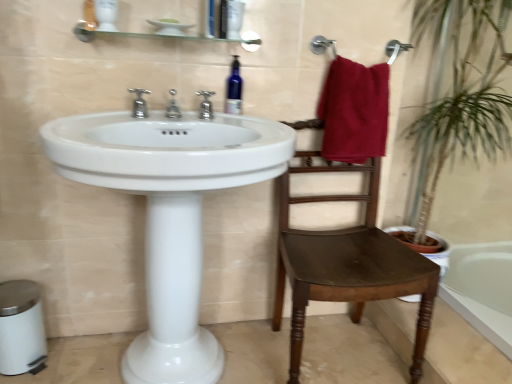
Where is `polished chrome faucet at center, the 1th tap in the right-to-left sequence`? Image resolution: width=512 pixels, height=384 pixels. polished chrome faucet at center, the 1th tap in the right-to-left sequence is located at coordinates (206, 105).

What is the approximate width of silver metallic faucet at upper center, the 2th tap when ordered from left to right?

silver metallic faucet at upper center, the 2th tap when ordered from left to right, is 5.77 inches wide.

Image resolution: width=512 pixels, height=384 pixels. What do you see at coordinates (170, 213) in the screenshot?
I see `white glossy sink at center` at bounding box center [170, 213].

I want to click on polished chrome faucet at center, the third tap from the right, so click(x=139, y=103).

This screenshot has width=512, height=384. What are the coordinates of `dark wood chair at right` in the screenshot? It's located at (347, 263).

The height and width of the screenshot is (384, 512). In order to click on maroon fabric towel at upper right in this screenshot , I will do `click(354, 111)`.

Image resolution: width=512 pixels, height=384 pixels. Describe the element at coordinates (234, 89) in the screenshot. I see `blue glass bottle at upper center` at that location.

Identify the location of polished chrome faucet at center, the 1th tap in the right-to-left sequence. The image size is (512, 384). (206, 105).

From the image's perspective, would you say polished chrome faucet at center, the 1th tap in the right-to-left sequence, is shown under smooth white bathtub at lower right?

No, from the image's perspective, polished chrome faucet at center, the 1th tap in the right-to-left sequence, is not beneath smooth white bathtub at lower right.

Is the depth of polished chrome faucet at center, the 1th tap in the right-to-left sequence, greater than that of smooth white bathtub at lower right?

Yes, it is behind smooth white bathtub at lower right.

From a real-world perspective, count 2nd taps upward from the smooth white bathtub at lower right and point to it. Please provide its 2D coordinates.

[(206, 105)]

Is polished chrome faucet at center, the third tap positioned from the left, to the left of smooth white bathtub at lower right from the viewer's perspective?

Yes, polished chrome faucet at center, the third tap positioned from the left, is to the left of smooth white bathtub at lower right.

Considering the sizes of dark wood chair at right and silver metallic faucet at upper center, the 2th tap when ordered from left to right, in the image, is dark wood chair at right wider or thinner than silver metallic faucet at upper center, the 2th tap when ordered from left to right,?

In the image, dark wood chair at right appears to be wider than silver metallic faucet at upper center, the 2th tap when ordered from left to right.

From the image's perspective, is dark wood chair at right below silver metallic faucet at upper center, the 2th tap positioned from the right?

Yes.

Is dark wood chair at right positioned behind silver metallic faucet at upper center, the 2th tap positioned from the right?

No, dark wood chair at right is in front of silver metallic faucet at upper center, the 2th tap positioned from the right.

Would you say silver metallic faucet at upper center, the 2th tap positioned from the right, is part of dark wood chair at right's contents?

That's incorrect, silver metallic faucet at upper center, the 2th tap positioned from the right, is not inside dark wood chair at right.

From the image's perspective, is dark wood chair at right located above blue glass bottle at upper center?

Actually, dark wood chair at right appears below blue glass bottle at upper center in the image.

Considering the points (314, 262) and (229, 94), which point is behind, point (314, 262) or point (229, 94)?

Positioned behind is point (229, 94).

Is dark wood chair at right touching blue glass bottle at upper center?

No, dark wood chair at right is not making contact with blue glass bottle at upper center.

Are smooth white bathtub at lower right and polished chrome faucet at center, the third tap from the right, located far from each other?

smooth white bathtub at lower right is positioned a significant distance from polished chrome faucet at center, the third tap from the right.

You are a GUI agent. You are given a task and a screenshot of the screen. Output one action in this format:
    pyautogui.click(x=<x>, y=<y>)
    Task: Click on the 3rd tap to the left of the smooth white bathtub at lower right, starting your count from the anchor
    This screenshot has height=384, width=512.
    Given the screenshot: What is the action you would take?
    pyautogui.click(x=139, y=103)

Does smooth white bathtub at lower right have a greater height compared to polished chrome faucet at center, the 1th tap in the left-to-right sequence?

No, smooth white bathtub at lower right is not taller than polished chrome faucet at center, the 1th tap in the left-to-right sequence.

How much distance is there between smooth white bathtub at lower right and polished chrome faucet at center, the third tap from the right?

smooth white bathtub at lower right is 4.73 feet from polished chrome faucet at center, the third tap from the right.

Is polished chrome faucet at center, the third tap from the right, oriented away from silver metallic faucet at upper center, the 2th tap positioned from the right?

polished chrome faucet at center, the third tap from the right, does not have its back to silver metallic faucet at upper center, the 2th tap positioned from the right.

Who is smaller, polished chrome faucet at center, the third tap from the right, or silver metallic faucet at upper center, the 2th tap when ordered from left to right?

With smaller size is silver metallic faucet at upper center, the 2th tap when ordered from left to right.

From their relative heights in the image, would you say polished chrome faucet at center, the 1th tap in the left-to-right sequence, is taller or shorter than silver metallic faucet at upper center, the 2th tap positioned from the right?

Considering their sizes, polished chrome faucet at center, the 1th tap in the left-to-right sequence, has more height than silver metallic faucet at upper center, the 2th tap positioned from the right.

Is the surface of polished chrome faucet at center, the third tap from the right, in direct contact with silver metallic faucet at upper center, the 2th tap positioned from the right?

Yes, polished chrome faucet at center, the third tap from the right, is right next to silver metallic faucet at upper center, the 2th tap positioned from the right, and making contact.

Based on the photo, from the image's perspective, is blue glass bottle at upper center located above or below silver metallic faucet at upper center, the 2th tap positioned from the right?

From the image's perspective, blue glass bottle at upper center appears above silver metallic faucet at upper center, the 2th tap positioned from the right.

Are blue glass bottle at upper center and silver metallic faucet at upper center, the 2th tap positioned from the right, far apart?

That's not correct — blue glass bottle at upper center is a little close to silver metallic faucet at upper center, the 2th tap positioned from the right.

From a real-world perspective, which object stands above the other?

blue glass bottle at upper center, from a real-world perspective.

Does silver metallic faucet at upper center, the 2th tap when ordered from left to right, turn towards polished chrome faucet at center, the third tap positioned from the left?

No, silver metallic faucet at upper center, the 2th tap when ordered from left to right, is not facing towards polished chrome faucet at center, the third tap positioned from the left.

Are silver metallic faucet at upper center, the 2th tap positioned from the right, and polished chrome faucet at center, the third tap positioned from the left, beside each other?

No, silver metallic faucet at upper center, the 2th tap positioned from the right, is not in contact with polished chrome faucet at center, the third tap positioned from the left.

Who is taller, silver metallic faucet at upper center, the 2th tap positioned from the right, or polished chrome faucet at center, the third tap positioned from the left?

Standing taller between the two is polished chrome faucet at center, the third tap positioned from the left.

I want to click on bath that is in front of the polished chrome faucet at center, the 1th tap in the right-to-left sequence, so click(480, 296).

Where is `chair beneath the silver metallic faucet at upper center, the 2th tap positioned from the right (from a real-world perspective)`? chair beneath the silver metallic faucet at upper center, the 2th tap positioned from the right (from a real-world perspective) is located at coordinates (347, 263).

Estimate the real-world distances between objects in this image. Which object is closer to white glossy sink at center, blue glass bottle at upper center or maroon fabric towel at upper right?

Based on the image, blue glass bottle at upper center appears to be nearer to white glossy sink at center.

Looking at the image, which one is located closer to maroon fabric towel at upper right, blue glass bottle at upper center or smooth white bathtub at lower right?

blue glass bottle at upper center lies closer to maroon fabric towel at upper right than the other object.

In the scene shown: From the image, which object appears to be farther from smooth white bathtub at lower right, polished chrome faucet at center, the third tap positioned from the left, or silver metallic faucet at upper center, the 2th tap positioned from the right?

Based on the image, silver metallic faucet at upper center, the 2th tap positioned from the right, appears to be further to smooth white bathtub at lower right.

Based on their spatial positions, is white glossy sink at center or maroon fabric towel at upper right further from smooth white bathtub at lower right?

Based on the image, white glossy sink at center appears to be further to smooth white bathtub at lower right.

In the scene shown: From the image, which object appears to be farther from dark wood chair at right, white glossy sink at center or maroon fabric towel at upper right?

Among the two, white glossy sink at center is located further to dark wood chair at right.

Looking at the image, which one is located closer to blue glass bottle at upper center, polished chrome faucet at center, the 1th tap in the left-to-right sequence, or maroon fabric towel at upper right?

polished chrome faucet at center, the 1th tap in the left-to-right sequence, is closer to blue glass bottle at upper center.

From the image, which object appears to be farther from dark wood chair at right, blue glass bottle at upper center or smooth white bathtub at lower right?

The object further to dark wood chair at right is blue glass bottle at upper center.

Based on their spatial positions, is polished chrome faucet at center, the 1th tap in the right-to-left sequence, or smooth white bathtub at lower right closer to polished chrome faucet at center, the 1th tap in the left-to-right sequence?

polished chrome faucet at center, the 1th tap in the right-to-left sequence, is closer to polished chrome faucet at center, the 1th tap in the left-to-right sequence.

You are a GUI agent. You are given a task and a screenshot of the screen. Output one action in this format:
    pyautogui.click(x=<x>, y=<y>)
    Task: Click on the chair between white glossy sink at center and maroon fabric towel at upper right
    The height and width of the screenshot is (384, 512).
    Given the screenshot: What is the action you would take?
    pyautogui.click(x=347, y=263)

Where is `tap between silver metallic faucet at upper center, the 2th tap positioned from the right, and maroon fabric towel at upper right from left to right`? Image resolution: width=512 pixels, height=384 pixels. tap between silver metallic faucet at upper center, the 2th tap positioned from the right, and maroon fabric towel at upper right from left to right is located at coordinates (206, 105).

Where is `bottle between polished chrome faucet at center, the third tap from the right, and dark wood chair at right, in the horizontal direction`? This screenshot has width=512, height=384. bottle between polished chrome faucet at center, the third tap from the right, and dark wood chair at right, in the horizontal direction is located at coordinates (234, 89).

You are a GUI agent. You are given a task and a screenshot of the screen. Output one action in this format:
    pyautogui.click(x=<x>, y=<y>)
    Task: Click on the sink situated between silver metallic faucet at upper center, the 2th tap when ordered from left to right, and maroon fabric towel at upper right from left to right
    The height and width of the screenshot is (384, 512).
    Given the screenshot: What is the action you would take?
    pyautogui.click(x=170, y=213)